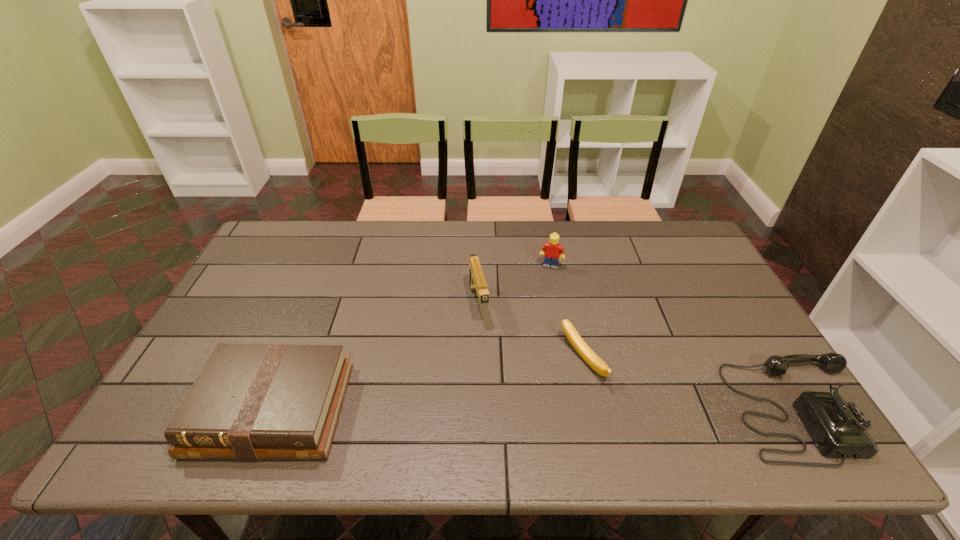
The image size is (960, 540). Find the location of `vacant area that lies between the Bible and the Lego`. vacant area that lies between the Bible and the Lego is located at coordinates (412, 338).

In order to click on free space between the fourth tallest object and the Lego in this screenshot , I will do `click(412, 338)`.

Locate an element on the screen. Image resolution: width=960 pixels, height=540 pixels. empty space that is in between the pistol and the Lego is located at coordinates click(x=515, y=285).

The image size is (960, 540). Identify the location of unoccupied position between the rightmost object and the farthest object. (676, 338).

At what (x,y) coordinates should I click in order to perform the action: click on unoccupied position between the second shortest object and the farthest object. Please return your answer as a coordinate pair (x, y). The width and height of the screenshot is (960, 540). Looking at the image, I should click on (412, 338).

Locate an element on the screen. This screenshot has height=540, width=960. free space between the fourth object from right to left and the Lego is located at coordinates (515, 285).

The width and height of the screenshot is (960, 540). Identify the location of free space between the telephone and the leftmost object. [x=537, y=409].

Identify the location of free area in between the banana and the rightmost object. The image size is (960, 540). (692, 384).

At what (x,y) coordinates should I click in order to perform the action: click on object that ranks as the second closest to the fourth tallest object. Please return your answer as a coordinate pair (x, y). Image resolution: width=960 pixels, height=540 pixels. Looking at the image, I should click on (589, 356).

Locate an element on the screen. This screenshot has height=540, width=960. object that stands as the third closest to the rightmost object is located at coordinates (477, 282).